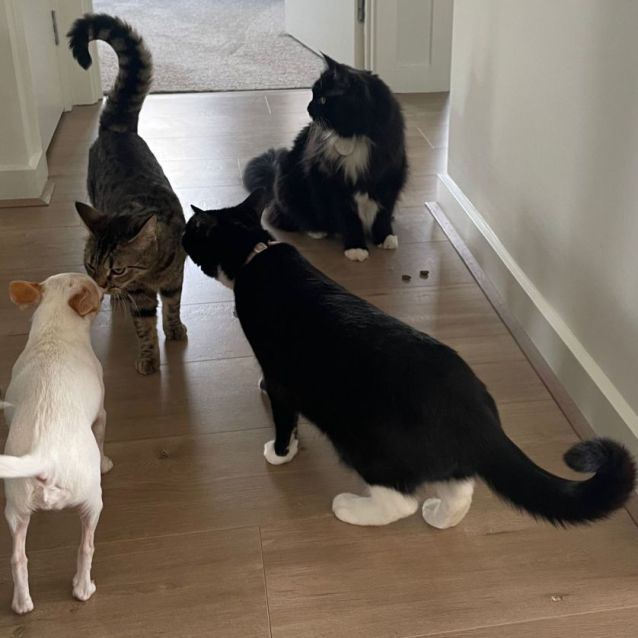
Where is `hardwood floor`? This screenshot has height=638, width=638. hardwood floor is located at coordinates (221, 483), (429, 136).